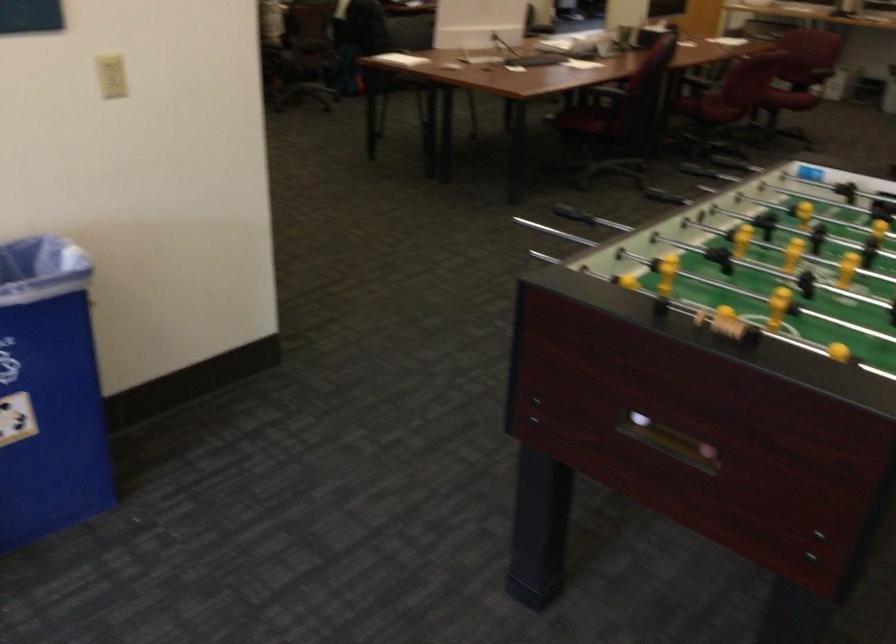
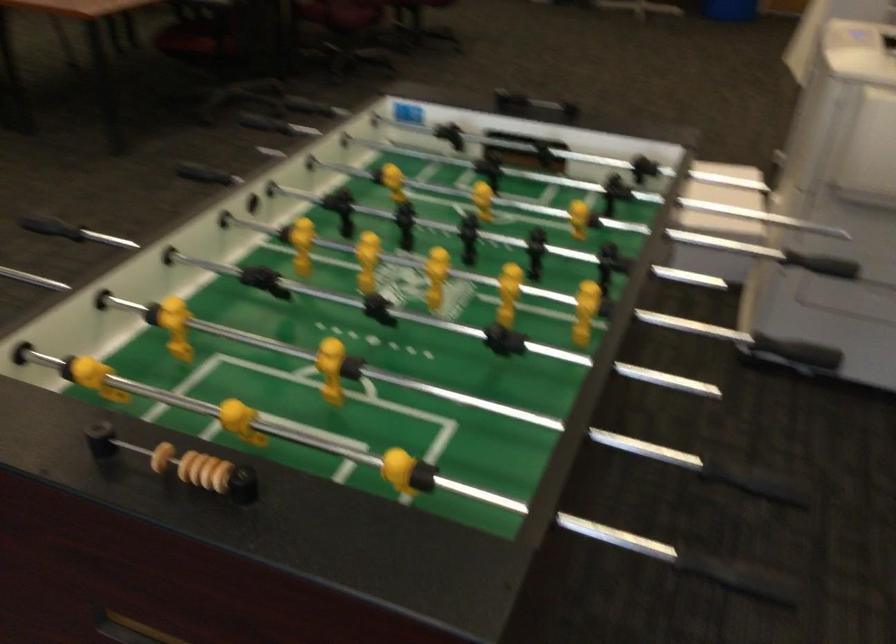
In a continuous first-person perspective shot, in which direction is the camera moving?

The cameraman moved toward right, forward.